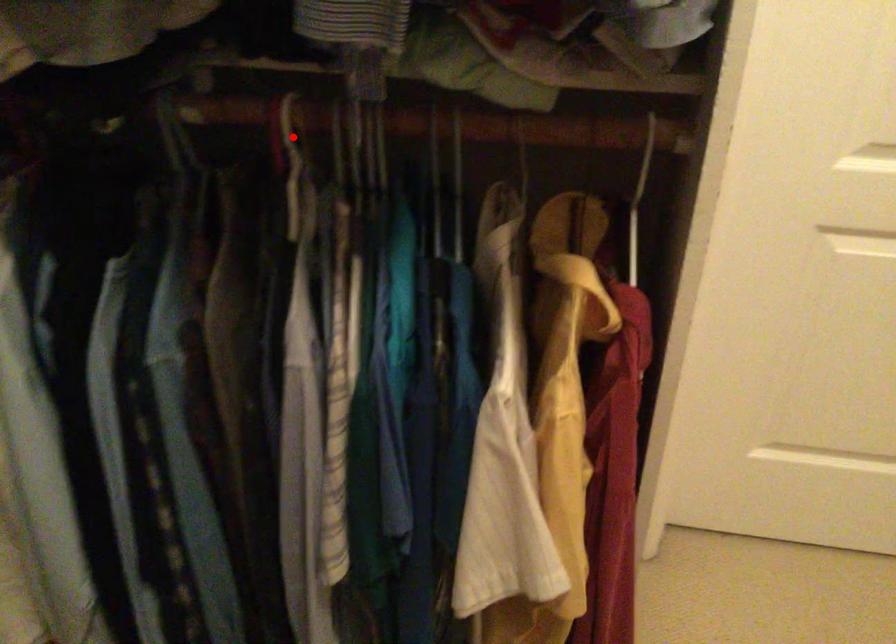
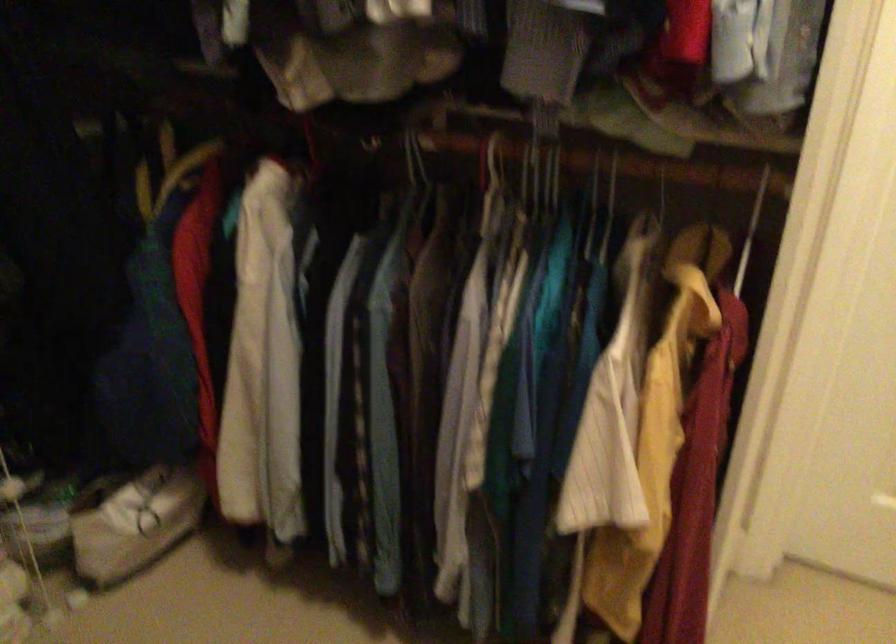
Question: A red point is marked in image1. In image2, is the corresponding 3D point closer to the camera or farther? Reply with the corresponding letter.

Choices:
 (A) The corresponding 3D point is closer.
 (B) The corresponding 3D point is farther.

Answer: (B)